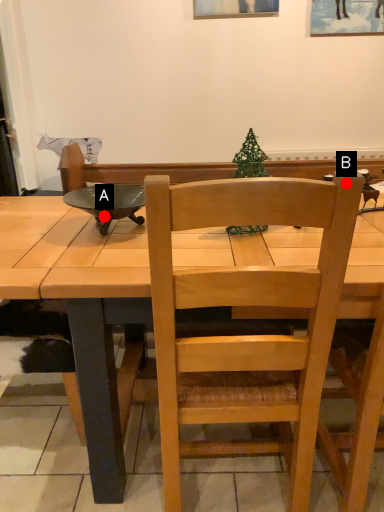
Question: Two points are circled on the image, labeled by A and B beside each circle. Which point is closer to the camera?

Choices:
 (A) A is closer
 (B) B is closer

Answer: (B)